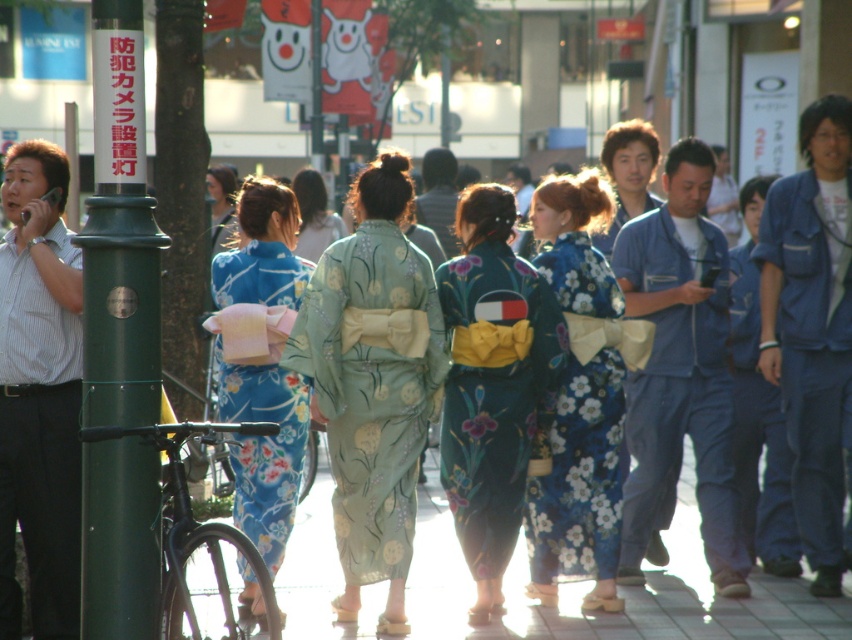
You are standing on the sidewalk and want to reach a point that is 26.15 feet away from you. Can you walk straight ahead to reach the point labeled as point (39, 326)?

Yes, because the distance of point (39, 326) from viewer is 26.15 feet, so you can walk straight ahead to reach it.

You are standing on the sidewalk in the image and want to take a photo of both point (677, 579) and point (597, 243). Which point should you focus on first to ensure both are in the frame?

You should focus on point (677, 579) first because it is closer to the camera than point (597, 243), allowing both points to be captured within the frame.

You are a photographer standing at the point marked as point (x=680, y=369). You want to take a photo of the denim jacket at center. Is the denim jacket at center visible from your current position?

The denim jacket at center is located at point (x=680, y=369), so yes, it is visible from your current position.